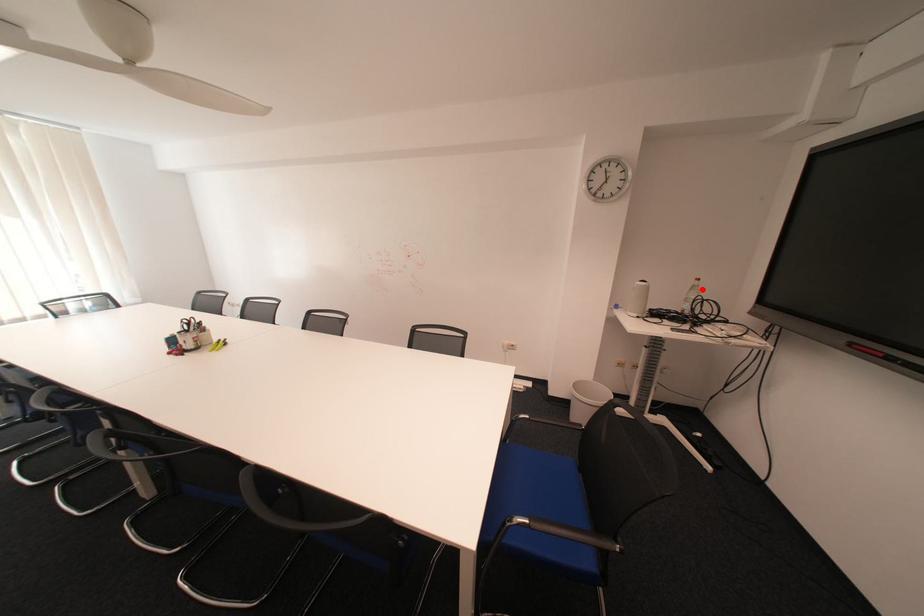
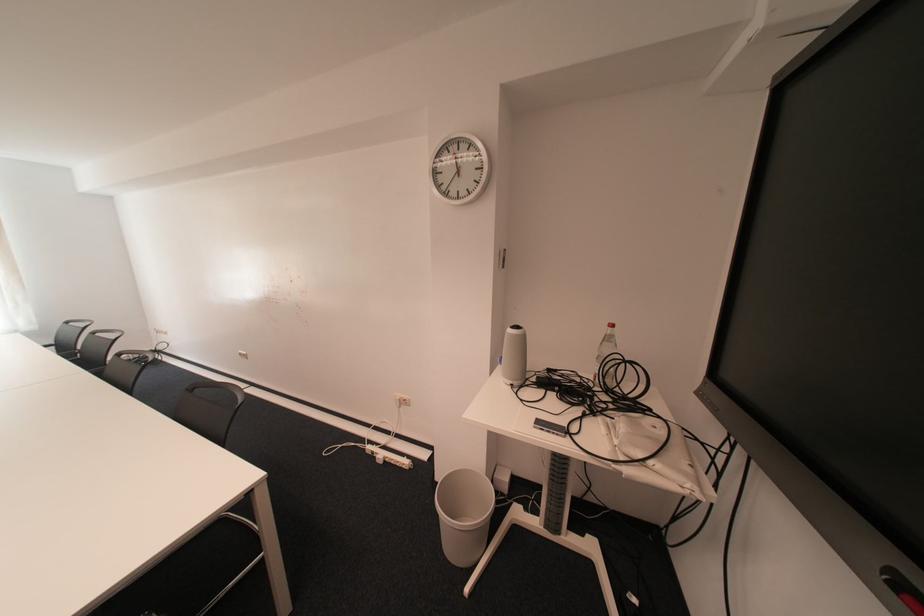
Question: I am providing you with two images of the same scene from different viewpoints. A red point is marked on the first image. At the location where the point appears in image 1, is it still visible in image 2?

Choices:
 (A) Yes
 (B) No

Answer: (A)